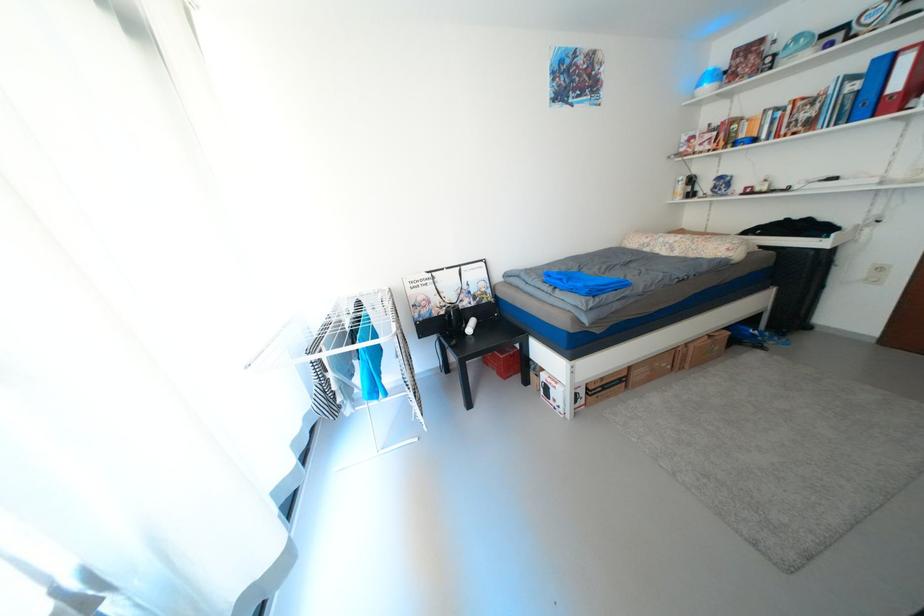
Where is `blue binder`? blue binder is located at coordinates (584, 282).